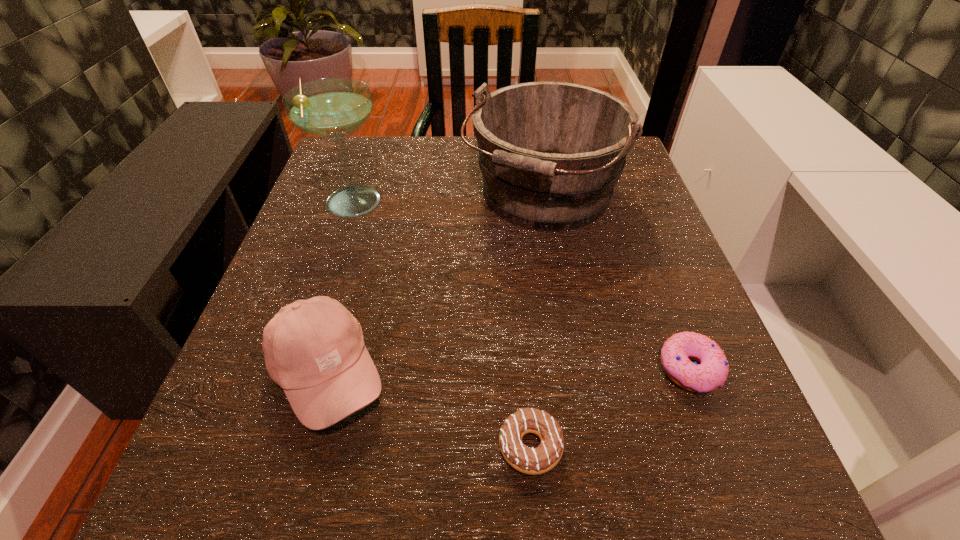
Find the location of a particular element. free space located 0.190m on the back of the right doughnut is located at coordinates (647, 256).

Locate an element on the screen. This screenshot has height=540, width=960. free space located 0.190m on the right of the shorter doughnut is located at coordinates (712, 446).

Locate an element on the screen. martini that is at the far edge is located at coordinates tap(332, 108).

Locate an element on the screen. The width and height of the screenshot is (960, 540). wine bucket present at the far edge is located at coordinates (550, 153).

The image size is (960, 540). In order to click on object that is at the near edge in this screenshot , I will do `click(533, 461)`.

You are a GUI agent. You are given a task and a screenshot of the screen. Output one action in this format:
    pyautogui.click(x=<x>, y=<y>)
    Task: Click on the martini situated at the left edge
    
    Given the screenshot: What is the action you would take?
    pyautogui.click(x=332, y=108)

The image size is (960, 540). Identify the location of baseball cap positioned at the left edge. (314, 349).

Locate an element on the screen. wine bucket that is at the right edge is located at coordinates (550, 153).

The width and height of the screenshot is (960, 540). I want to click on doughnut situated at the right edge, so click(711, 373).

This screenshot has height=540, width=960. In order to click on object that is at the far left corner in this screenshot , I will do `click(332, 108)`.